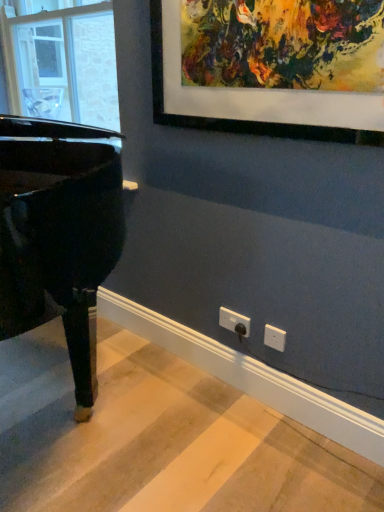
Question: Is transparent glass window at left smaller than glossy black piano at left?

Choices:
 (A) yes
 (B) no

Answer: (A)

Question: Is transparent glass window at left behind glossy black piano at left?

Choices:
 (A) no
 (B) yes

Answer: (B)

Question: Considering the relative sizes of transparent glass window at left and glossy black piano at left in the image provided, is transparent glass window at left shorter than glossy black piano at left?

Choices:
 (A) yes
 (B) no

Answer: (A)

Question: Is transparent glass window at left positioned with its back to glossy black piano at left?

Choices:
 (A) no
 (B) yes

Answer: (A)

Question: From the image's perspective, does transparent glass window at left appear higher than glossy black piano at left?

Choices:
 (A) no
 (B) yes

Answer: (B)

Question: Is transparent glass window at left at the right side of glossy black piano at left?

Choices:
 (A) yes
 (B) no

Answer: (B)

Question: Considering the relative sizes of white plastic electric outlet at lower center and glossy black piano at left in the image provided, is white plastic electric outlet at lower center wider than glossy black piano at left?

Choices:
 (A) no
 (B) yes

Answer: (A)

Question: Is white plastic electric outlet at lower center at the left side of glossy black piano at left?

Choices:
 (A) no
 (B) yes

Answer: (A)

Question: Does white plastic electric outlet at lower center lie in front of glossy black piano at left?

Choices:
 (A) yes
 (B) no

Answer: (B)

Question: Can you confirm if white plastic electric outlet at lower center is positioned to the right of glossy black piano at left?

Choices:
 (A) yes
 (B) no

Answer: (A)

Question: Is glossy black piano at left a part of white plastic electric outlet at lower center?

Choices:
 (A) yes
 (B) no

Answer: (B)

Question: Does white plastic electric outlet at lower center touch glossy black piano at left?

Choices:
 (A) yes
 (B) no

Answer: (B)

Question: From a real-world perspective, is glossy black piano at left on top of transparent glass window at left?

Choices:
 (A) no
 (B) yes

Answer: (A)